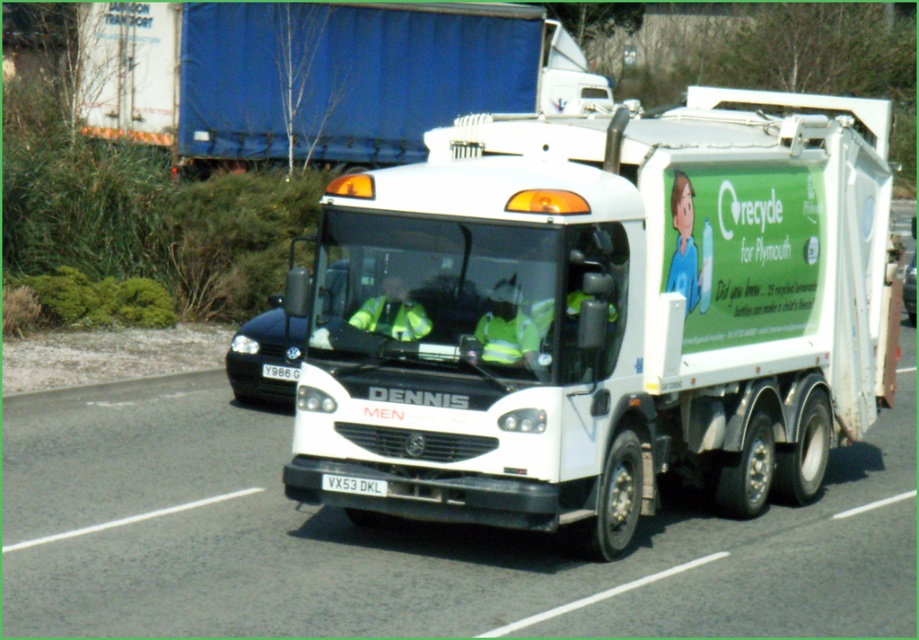
Question: Can you confirm if white glossy garbage truck at center is smaller than blue tarpaulin truck at upper center?

Choices:
 (A) yes
 (B) no

Answer: (A)

Question: Is blue tarpaulin truck at upper center in front of high visibility reflective jacket at center?

Choices:
 (A) yes
 (B) no

Answer: (B)

Question: Which of these objects is positioned closest to the black glossy car at center?

Choices:
 (A) high visibility reflective jacket at center
 (B) white glossy garbage truck at center
 (C) blue tarpaulin truck at upper center

Answer: (A)

Question: Which object is closer to the camera taking this photo?

Choices:
 (A) reflective yellow vest at center
 (B) high visibility reflective jacket at center

Answer: (A)

Question: Can you confirm if white glossy garbage truck at center is wider than black glossy car at center?

Choices:
 (A) no
 (B) yes

Answer: (A)

Question: Which of these objects is positioned closest to the reflective yellow vest at center?

Choices:
 (A) white glossy garbage truck at center
 (B) blue tarpaulin truck at upper center
 (C) black glossy car at left

Answer: (A)